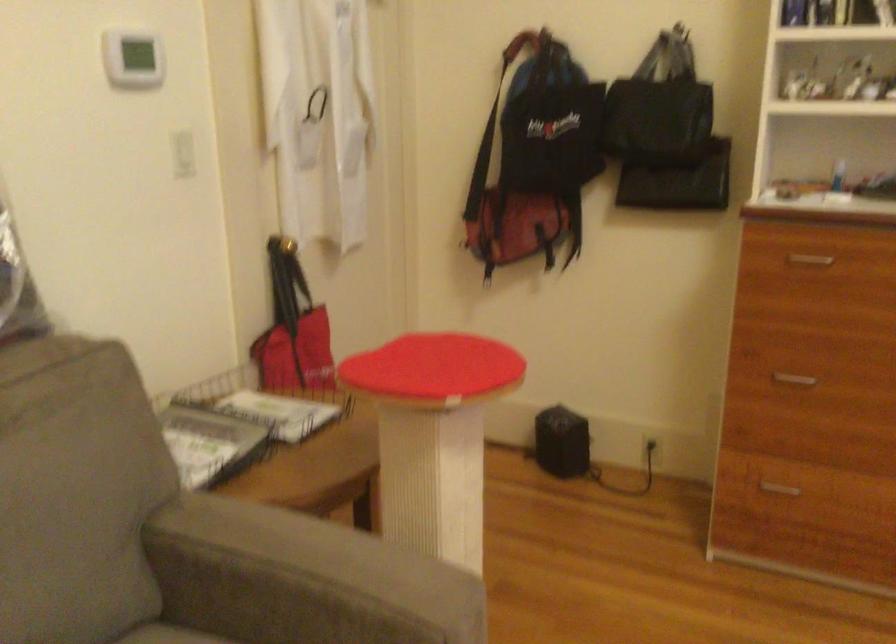
This screenshot has width=896, height=644. What do you see at coordinates (302, 579) in the screenshot?
I see `a gray sofa armrest` at bounding box center [302, 579].